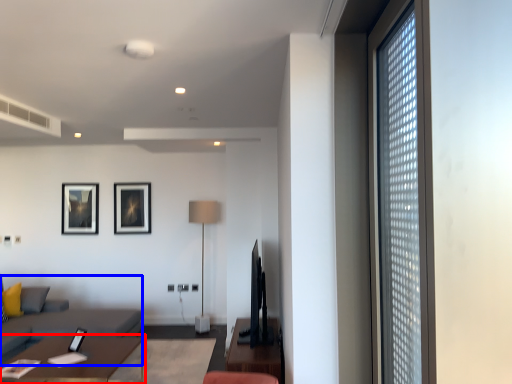
Question: Which point is further to the camera, table (highlighted by a red box) or couch (highlighted by a blue box)?

Choices:
 (A) table
 (B) couch

Answer: (B)